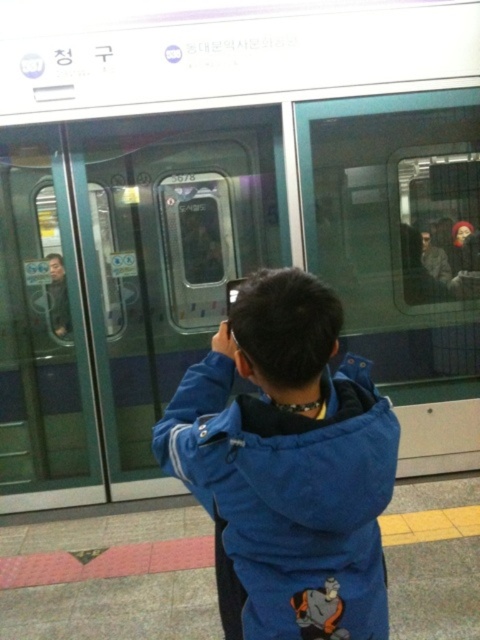
Question: Which of the following is the farthest from the observer?

Choices:
 (A) (48, 296)
 (B) (351, 412)

Answer: (A)

Question: Is matte black jacket at left further to the viewer compared to black plastic phone at upper center?

Choices:
 (A) no
 (B) yes

Answer: (A)

Question: Is blue fabric jacket at center to the right of matte black jacket at left from the viewer's perspective?

Choices:
 (A) yes
 (B) no

Answer: (A)

Question: Which of the following is the farthest from the observer?

Choices:
 (A) black plastic phone at upper center
 (B) matte black jacket at left
 (C) blue fabric jacket at center

Answer: (A)

Question: Based on their relative distances, which object is nearer to the black plastic phone at upper center?

Choices:
 (A) matte black jacket at left
 (B) blue fabric jacket at center

Answer: (A)

Question: Does blue fabric jacket at center have a smaller size compared to matte black jacket at left?

Choices:
 (A) yes
 (B) no

Answer: (B)